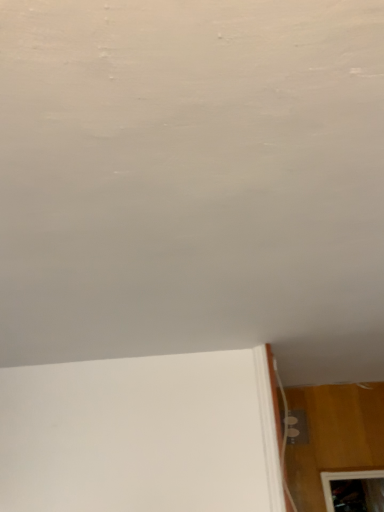
Question: Is white matte wall at upper center at the back of white glossy electric outlet at lower right?

Choices:
 (A) yes
 (B) no

Answer: (B)

Question: Is the position of white glossy electric outlet at lower right less distant than that of white matte wall at upper center?

Choices:
 (A) yes
 (B) no

Answer: (B)

Question: Is white glossy electric outlet at lower right located outside white matte wall at upper center?

Choices:
 (A) no
 (B) yes

Answer: (B)

Question: Is white glossy electric outlet at lower right positioned behind white matte wall at upper center?

Choices:
 (A) yes
 (B) no

Answer: (A)

Question: Is the surface of white glossy electric outlet at lower right in direct contact with white matte wall at upper center?

Choices:
 (A) no
 (B) yes

Answer: (A)

Question: Considering the relative sizes of white glossy electric outlet at lower right and white matte wall at upper center in the image provided, is white glossy electric outlet at lower right smaller than white matte wall at upper center?

Choices:
 (A) yes
 (B) no

Answer: (A)

Question: Is white matte wall at upper center completely or partially outside of white glossy electric outlet at lower right?

Choices:
 (A) no
 (B) yes

Answer: (B)

Question: From the image's perspective, is white matte wall at upper center beneath white glossy electric outlet at lower right?

Choices:
 (A) yes
 (B) no

Answer: (B)

Question: Is white matte wall at upper center to the left of white glossy electric outlet at lower right from the viewer's perspective?

Choices:
 (A) no
 (B) yes

Answer: (B)

Question: Does white matte wall at upper center have a greater height compared to white glossy electric outlet at lower right?

Choices:
 (A) yes
 (B) no

Answer: (B)

Question: Is there a large distance between white matte wall at upper center and white glossy electric outlet at lower right?

Choices:
 (A) yes
 (B) no

Answer: (A)

Question: From a real-world perspective, is white matte wall at upper center physically below white glossy electric outlet at lower right?

Choices:
 (A) yes
 (B) no

Answer: (B)

Question: Is white matte wall at upper center bigger or smaller than white glossy electric outlet at lower right?

Choices:
 (A) big
 (B) small

Answer: (A)